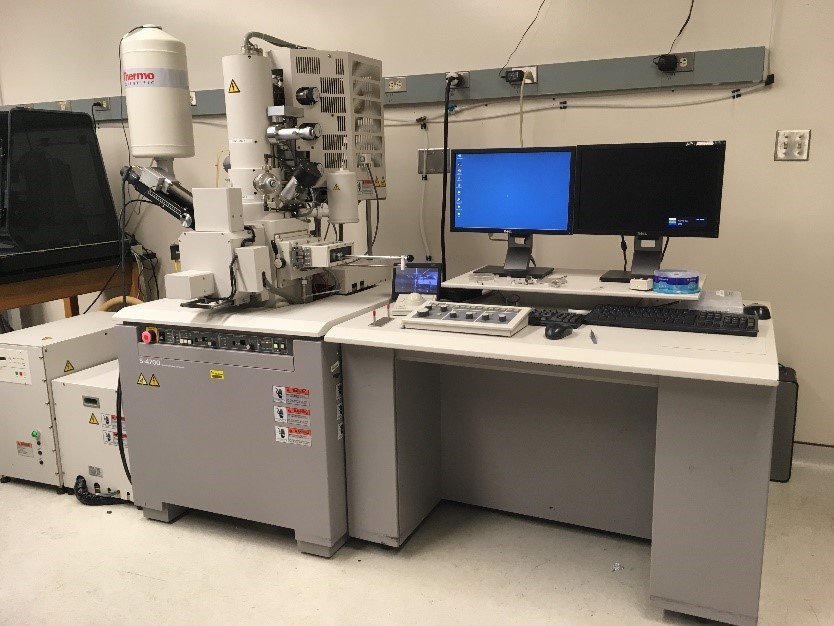
Identify the location of gray wall. This screenshot has width=834, height=626. (435, 44).